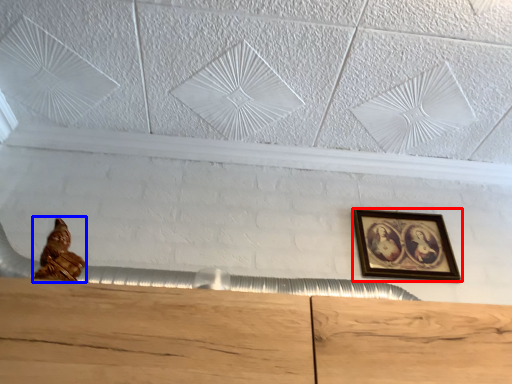
Question: Among these objects, which one is nearest to the camera, picture frame (highlighted by a red box) or sculpture (highlighted by a blue box)?

Choices:
 (A) picture frame
 (B) sculpture

Answer: (B)